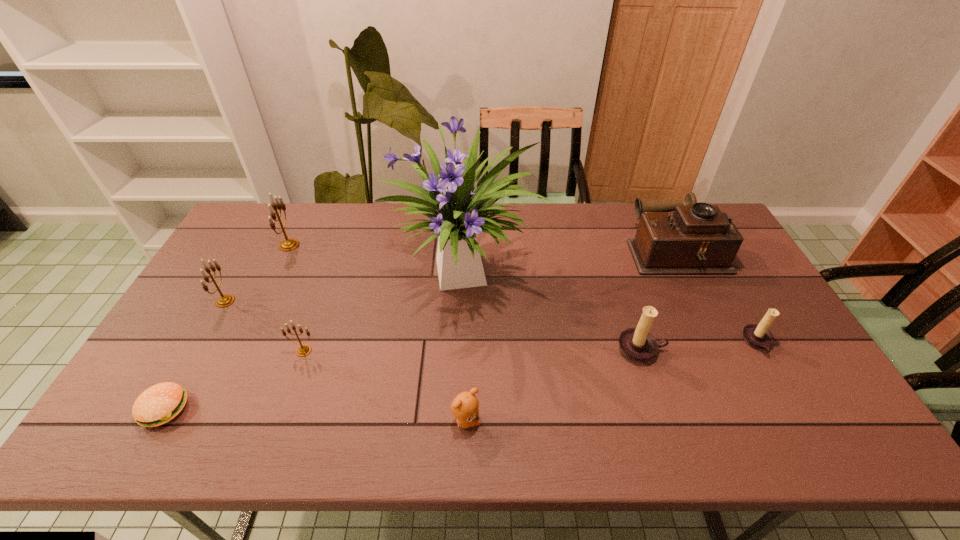
Where is `candelabrum located at the far edge`? Image resolution: width=960 pixels, height=540 pixels. candelabrum located at the far edge is located at coordinates (289, 244).

Identify the location of phonograph_record located in the far edge section of the desktop. This screenshot has height=540, width=960. (697, 238).

Identify the location of teddy bear that is positioned at the near edge. This screenshot has height=540, width=960. (465, 407).

Identify the location of patty that is at the near edge. pos(159,404).

In order to click on candelabrum located at the left edge in this screenshot , I will do `click(225, 300)`.

This screenshot has width=960, height=540. I want to click on patty positioned at the left edge, so click(159, 404).

The width and height of the screenshot is (960, 540). What are the coordinates of `phonograph_record that is at the right edge` in the screenshot? It's located at (697, 238).

This screenshot has height=540, width=960. I want to click on candle holder that is at the right edge, so click(x=757, y=336).

Where is `object situated at the near left corner`? The image size is (960, 540). object situated at the near left corner is located at coordinates (159, 404).

I want to click on object that is positioned at the far right corner, so click(x=697, y=238).